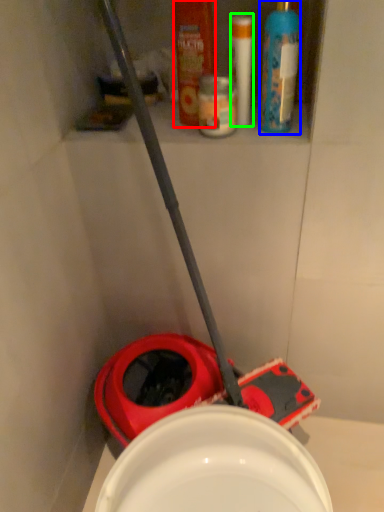
Question: Considering the real-world distances, which object is farthest from mouthwash (highlighted by a red box)? cleaning product (highlighted by a blue box) or toiletry (highlighted by a green box)?

Choices:
 (A) cleaning product
 (B) toiletry

Answer: (A)